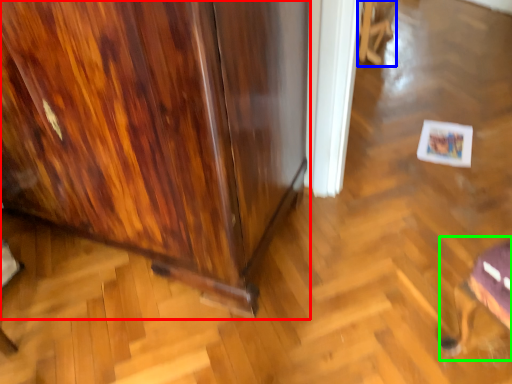
Question: Which object is positioned farthest from furniture (highlighted by a red box)? Select from swivel chair (highlighted by a blue box) and swivel chair (highlighted by a green box).

Choices:
 (A) swivel chair
 (B) swivel chair

Answer: (A)